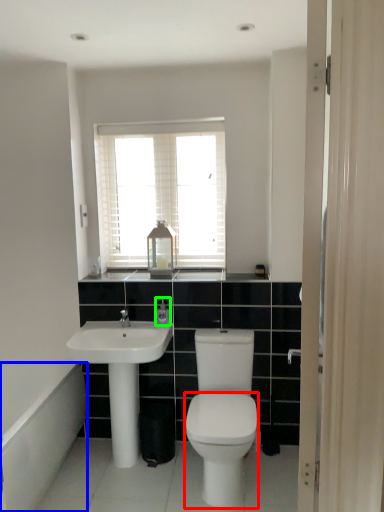
Question: Which object is positioned closest to bidet (highlighted by a red box)? Select from bath (highlighted by a blue box) and toiletry (highlighted by a green box).

Choices:
 (A) bath
 (B) toiletry

Answer: (B)